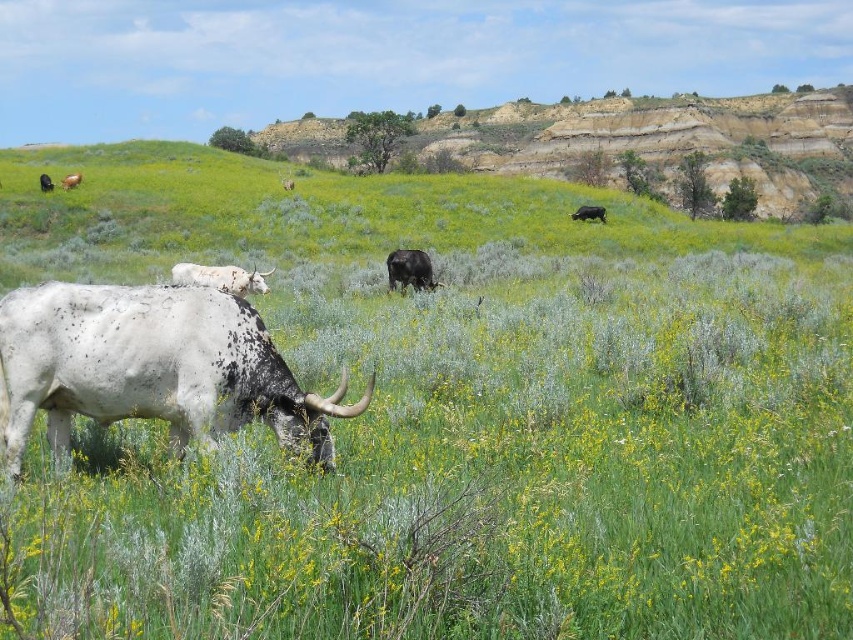
Does speckled white bull at lower left have a greater height compared to black matte bull at center?

Indeed, speckled white bull at lower left has a greater height compared to black matte bull at center.

Is point (91, 326) positioned after point (427, 262)?

No, (91, 326) is in front of (427, 262).

Is point (32, 337) positioned after point (415, 272)?

No.

Where is `speckled white bull at lower left`? The image size is (853, 640). speckled white bull at lower left is located at coordinates (149, 368).

Can you confirm if dark brown cow at upper right is shorter than brown matte cow at upper left?

Indeed, dark brown cow at upper right has a lesser height compared to brown matte cow at upper left.

The image size is (853, 640). In order to click on dark brown cow at upper right in this screenshot , I will do `click(589, 212)`.

From the picture: Between earthy brown cliff at upper center and white speckled cow at center, which one has more height?

With more height is earthy brown cliff at upper center.

Is point (595, 144) closer to camera compared to point (212, 269)?

No, (595, 144) is behind (212, 269).

Is point (531, 134) positioned before point (218, 268)?

No, it is not.

Where is `earthy brown cliff at upper center`? The height and width of the screenshot is (640, 853). earthy brown cliff at upper center is located at coordinates (668, 141).